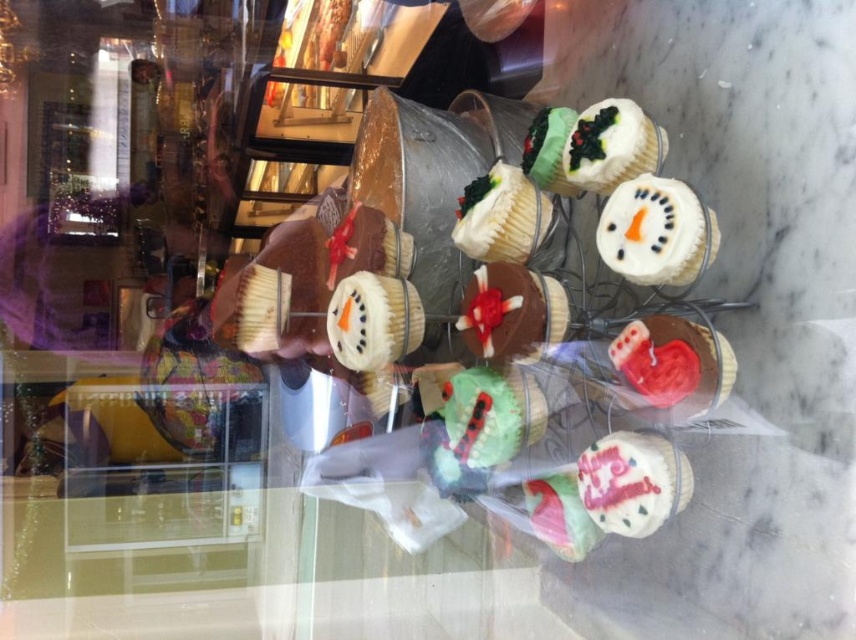
Question: Which point is closer to the camera?

Choices:
 (A) (412, 321)
 (B) (581, 499)

Answer: (B)

Question: Does white chocolate cupcake at center appear on the right side of pastel pink frosting at center?

Choices:
 (A) no
 (B) yes

Answer: (A)

Question: Which object is positioned closest to the white frosted cupcake at center?

Choices:
 (A) white fondant cupcake at upper right
 (B) white chocolate cupcake at center
 (C) pastel pink frosting at center

Answer: (C)

Question: Can you confirm if white chocolate cupcake at center is thinner than white frosted cupcake at upper center?

Choices:
 (A) no
 (B) yes

Answer: (A)

Question: Estimate the real-world distances between objects in this image. Which object is closer to the pastel pink frosting at center?

Choices:
 (A) green matte cupcake at center
 (B) white fondant cupcake at upper right

Answer: (A)

Question: Is white fondant cupcake at upper right bigger than white frosted cupcake at center?

Choices:
 (A) yes
 (B) no

Answer: (A)